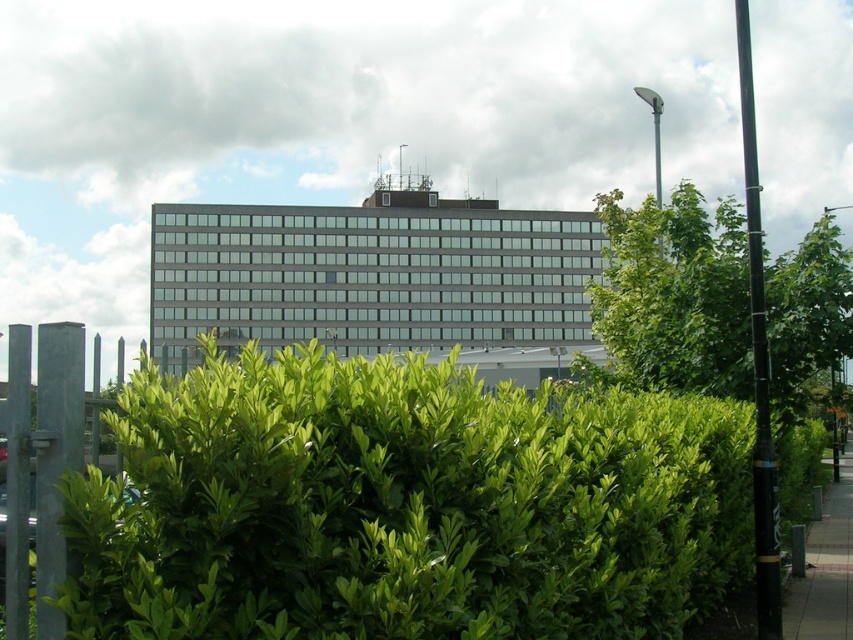
Question: Which point is closer to the camera taking this photo?

Choices:
 (A) (828, 536)
 (B) (276, 618)

Answer: (B)

Question: Based on their relative distances, which object is farther from the green leafy hedge at left?

Choices:
 (A) green leafy tree at right
 (B) paved concrete sidewalk at lower right

Answer: (A)

Question: Does green leafy hedge at left appear on the right side of paved concrete sidewalk at lower right?

Choices:
 (A) yes
 (B) no

Answer: (B)

Question: Can you confirm if green leafy hedge at left is wider than paved concrete sidewalk at lower right?

Choices:
 (A) yes
 (B) no

Answer: (A)

Question: Considering the real-world distances, which object is farthest from the green leafy hedge at left?

Choices:
 (A) green leafy tree at right
 (B) paved concrete sidewalk at lower right

Answer: (A)

Question: Is green leafy tree at right closer to camera compared to paved concrete sidewalk at lower right?

Choices:
 (A) yes
 (B) no

Answer: (A)